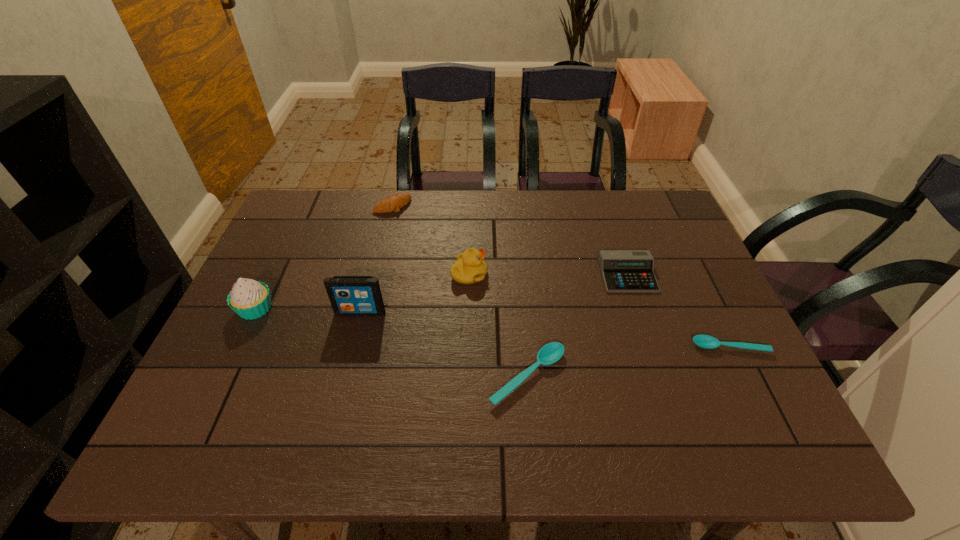
Find the location of `vacant area between the iPod and the leftmost object`. vacant area between the iPod and the leftmost object is located at coordinates (308, 310).

Find the location of `empty space between the leftmost object and the rightmost object`. empty space between the leftmost object and the rightmost object is located at coordinates (492, 328).

You are a GUI agent. You are given a task and a screenshot of the screen. Output one action in this format:
    pyautogui.click(x=<x>, y=<y>)
    Task: Click on the free area in between the leftmost object and the shorter spoon
    The height and width of the screenshot is (540, 960).
    Given the screenshot: What is the action you would take?
    pyautogui.click(x=492, y=328)

Where is `vacant space that is in between the shortest object and the left spoon`? vacant space that is in between the shortest object and the left spoon is located at coordinates (629, 361).

Where is `unoccupied position between the taller spoon and the iPod`? The image size is (960, 540). unoccupied position between the taller spoon and the iPod is located at coordinates (444, 345).

Where is `free space between the cupcake and the shorter spoon`? The height and width of the screenshot is (540, 960). free space between the cupcake and the shorter spoon is located at coordinates (492, 328).

Identify which object is the nearest to the cupcake. Please provide its 2D coordinates. Your answer should be formatted as a tuple, i.e. [(x, y)], where the tuple contains the x and y coordinates of a point satisfying the conditions above.

[(349, 295)]

Identify the location of object that stands as the second closest to the left spoon. The height and width of the screenshot is (540, 960). (622, 270).

Where is `vacant region that satisfies the following two spatial constraints: 1. on the front side of the cupcake; 2. on the left side of the shortest object`? vacant region that satisfies the following two spatial constraints: 1. on the front side of the cupcake; 2. on the left side of the shortest object is located at coordinates (237, 347).

Image resolution: width=960 pixels, height=540 pixels. I want to click on free space that satisfies the following two spatial constraints: 1. on the front screen of the iPod; 2. on the right side of the right spoon, so click(351, 347).